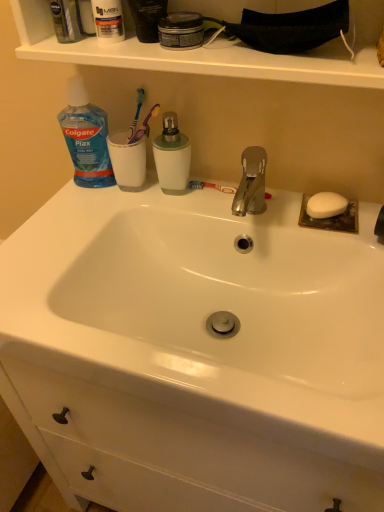
Question: Can we say white matte soap at right lies outside blue translucent plastic bottle at upper left?

Choices:
 (A) yes
 (B) no

Answer: (A)

Question: From the image's perspective, is white matte soap at right under blue translucent plastic bottle at upper left?

Choices:
 (A) no
 (B) yes

Answer: (B)

Question: Is white matte soap at right further to camera compared to blue translucent plastic bottle at upper left?

Choices:
 (A) yes
 (B) no

Answer: (A)

Question: Is white matte soap at right closer to the viewer compared to blue translucent plastic bottle at upper left?

Choices:
 (A) yes
 (B) no

Answer: (B)

Question: From the image's perspective, is white matte soap at right on blue translucent plastic bottle at upper left?

Choices:
 (A) yes
 (B) no

Answer: (B)

Question: From their relative heights in the image, would you say clear plastic mouthwash at upper left, acting as the 1th mouthwash starting from the top, is taller or shorter than white matte soap at right?

Choices:
 (A) short
 (B) tall

Answer: (B)

Question: From a real-world perspective, is clear plastic mouthwash at upper left, which is the first mouthwash in left-to-right order, physically located above or below white matte soap at right?

Choices:
 (A) below
 (B) above

Answer: (B)

Question: Is clear plastic mouthwash at upper left, the second mouthwash from the bottom, in front of or behind white matte soap at right in the image?

Choices:
 (A) front
 (B) behind

Answer: (A)

Question: From the image's perspective, is clear plastic mouthwash at upper left, which is counted as the second mouthwash, starting from the right, located above or below white matte soap at right?

Choices:
 (A) above
 (B) below

Answer: (A)

Question: Is white glossy sink at center to the left or to the right of blue plastic toothbrush at upper center in the image?

Choices:
 (A) right
 (B) left

Answer: (A)

Question: In terms of width, does white glossy sink at center look wider or thinner when compared to blue plastic toothbrush at upper center?

Choices:
 (A) thin
 (B) wide

Answer: (B)

Question: Is white glossy sink at center spatially inside blue plastic toothbrush at upper center, or outside of it?

Choices:
 (A) inside
 (B) outside

Answer: (B)

Question: In terms of height, does white glossy sink at center look taller or shorter compared to blue plastic toothbrush at upper center?

Choices:
 (A) short
 (B) tall

Answer: (B)

Question: From the image's perspective, relative to clear plastic mouthwash at upper left, the second mouthwash from the bottom, is white matte soap at right above or below?

Choices:
 (A) below
 (B) above

Answer: (A)

Question: From a real-world perspective, relative to clear plastic mouthwash at upper left, which is counted as the second mouthwash, starting from the right, is white matte soap at right vertically above or below?

Choices:
 (A) above
 (B) below

Answer: (B)